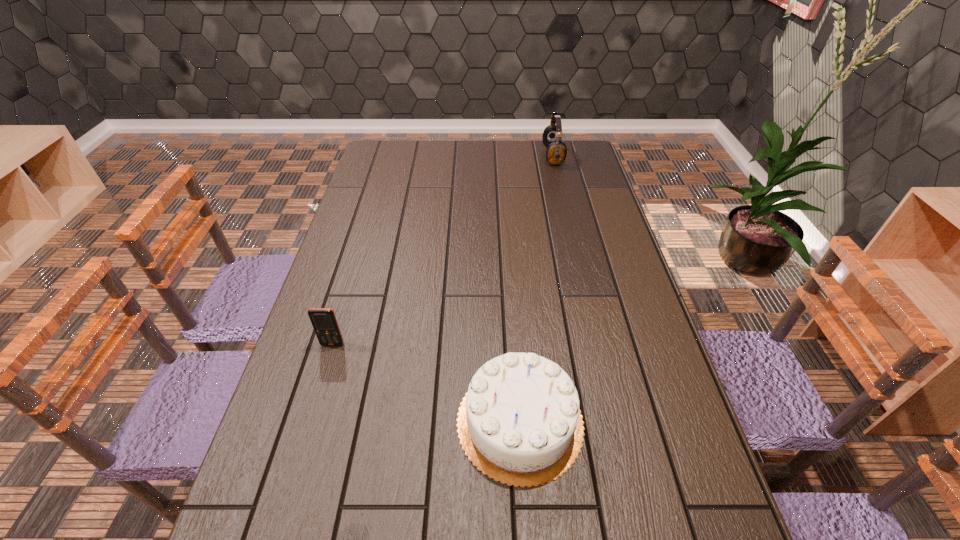
Where is `vacant area situated 0.090m on the screen of the cellular telephone`? Image resolution: width=960 pixels, height=540 pixels. vacant area situated 0.090m on the screen of the cellular telephone is located at coordinates (323, 377).

You are a GUI agent. You are given a task and a screenshot of the screen. Output one action in this format:
    pyautogui.click(x=<x>, y=<y>)
    Task: Click on the object that is at the far edge
    
    Given the screenshot: What is the action you would take?
    pyautogui.click(x=556, y=153)

Locate an element on the screen. object situated at the left edge is located at coordinates (324, 322).

Where is `object positioned at the right edge`? object positioned at the right edge is located at coordinates (556, 153).

The image size is (960, 540). I want to click on object situated at the far right corner, so click(556, 153).

At what (x,y) coordinates should I click in order to perform the action: click on free space at the far edge of the desktop. Please return your answer as a coordinate pair (x, y). Looking at the image, I should click on (492, 153).

Where is `free region at the left edge of the desktop`? free region at the left edge of the desktop is located at coordinates (354, 233).

At what (x,y) coordinates should I click in order to perform the action: click on free space at the right edge of the desktop. Please return your answer as a coordinate pair (x, y). The height and width of the screenshot is (540, 960). Looking at the image, I should click on (623, 261).

I want to click on free space at the far left corner of the desktop, so click(378, 166).

This screenshot has height=540, width=960. In order to click on vacant region between the rightmost object and the birthday cake in this screenshot , I will do `click(537, 289)`.